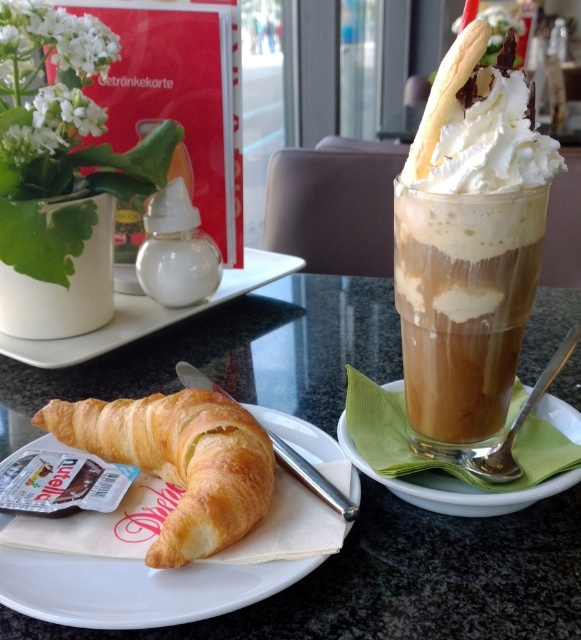
Between green napkin at center and white ceramic plate at upper center, which one appears on the right side from the viewer's perspective?

green napkin at center

This screenshot has width=581, height=640. Describe the element at coordinates (453, 483) in the screenshot. I see `green napkin at center` at that location.

Is point (514, 484) positioned before point (80, 349)?

That is True.

The width and height of the screenshot is (581, 640). Find the location of `green napkin at center`. green napkin at center is located at coordinates (453, 483).

Does golden brown flaky croissant at lower left have a lesser width compared to white ceramic plate at upper center?

Indeed, golden brown flaky croissant at lower left has a lesser width compared to white ceramic plate at upper center.

Does point (242, 508) come closer to viewer compared to point (58, 362)?

Yes, it is.

You are a GUI agent. You are given a task and a screenshot of the screen. Output one action in this format:
    pyautogui.click(x=<x>, y=<y>)
    Task: Click on the golden brown flaky croissant at lower left
    This screenshot has width=581, height=640.
    Given the screenshot: What is the action you would take?
    pyautogui.click(x=180, y=461)

Who is positioned more to the left, caramel frosted glass at right or green napkin at center?

From the viewer's perspective, caramel frosted glass at right appears more on the left side.

At what (x,y) coordinates should I click in order to perform the action: click on caramel frosted glass at right. Please return your answer as a coordinate pair (x, y). The image size is (581, 640). Looking at the image, I should click on (464, 307).